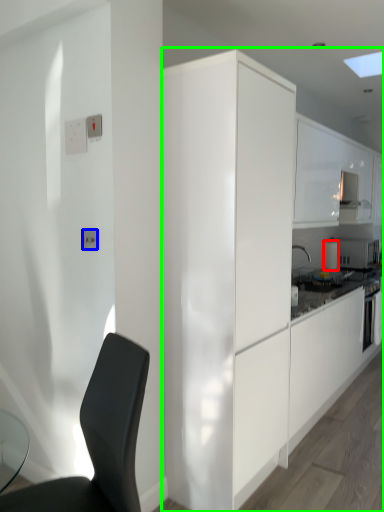
Question: Based on their relative distances, which object is nearer to appliance (highlighted by a red box)? Choose from electric outlet (highlighted by a blue box) and cabinetry (highlighted by a green box).

Choices:
 (A) electric outlet
 (B) cabinetry

Answer: (B)